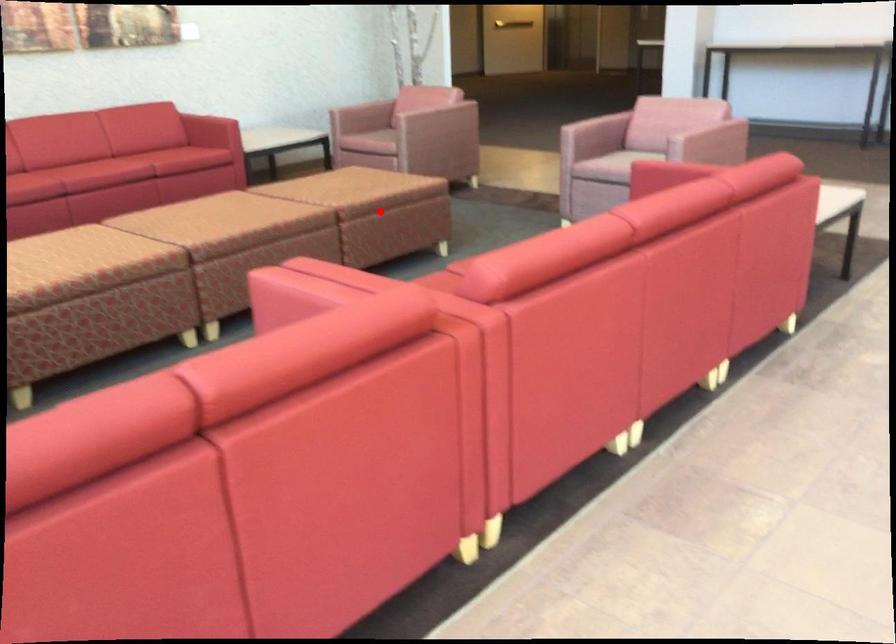
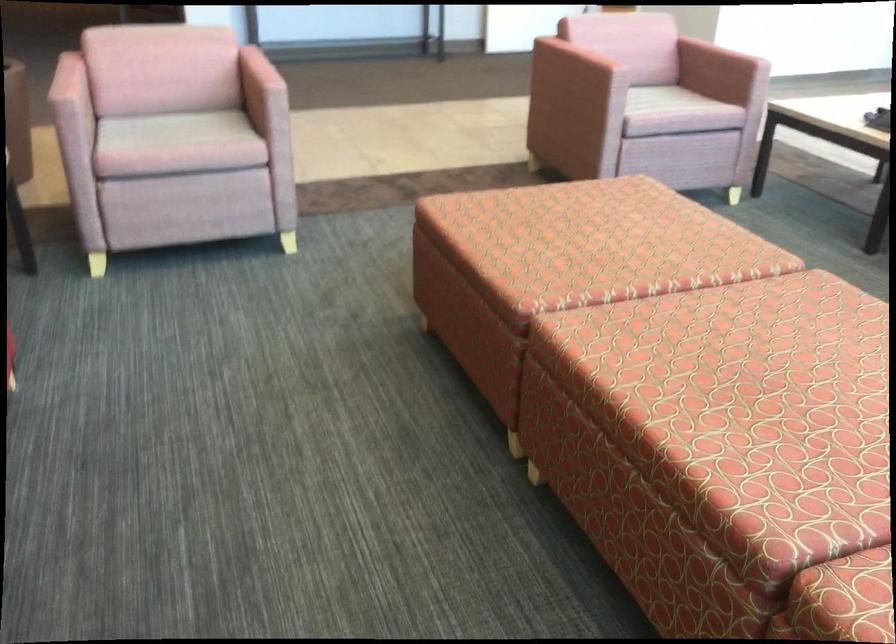
Question: I am providing you with two images of the same scene from different viewpoints. A red point is marked on the first image. At the location where the point appears in image 1, is it still visible in image 2?

Choices:
 (A) Yes
 (B) No

Answer: (B)